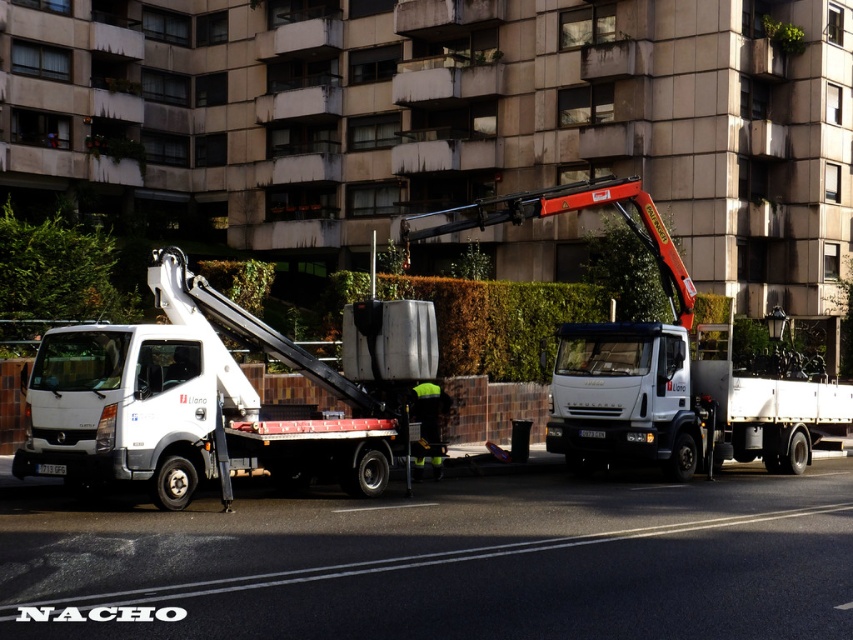
Question: Can you confirm if white matte truck at left is positioned to the left of white glossy tow truck at center?

Choices:
 (A) yes
 (B) no

Answer: (A)

Question: Which object is closer to the camera taking this photo?

Choices:
 (A) white matte truck at left
 (B) white matte truck at center

Answer: (A)

Question: Can you confirm if white glossy tow truck at center is bigger than white matte truck at center?

Choices:
 (A) yes
 (B) no

Answer: (A)

Question: Which point is closer to the camera?

Choices:
 (A) white matte truck at left
 (B) white glossy tow truck at center
 (C) white matte truck at center

Answer: (A)

Question: Does white glossy tow truck at center have a greater width compared to white matte truck at center?

Choices:
 (A) no
 (B) yes

Answer: (B)

Question: Which object is the farthest from the white matte truck at left?

Choices:
 (A) white matte truck at center
 (B) white glossy tow truck at center

Answer: (A)